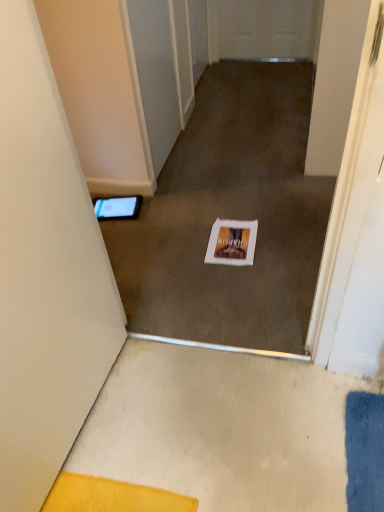
At what (x,y) coordinates should I click in order to perform the action: click on vacant area to the right of white paper at center. Please return your answer as a coordinate pair (x, y). The image size is (384, 512). Looking at the image, I should click on (282, 242).